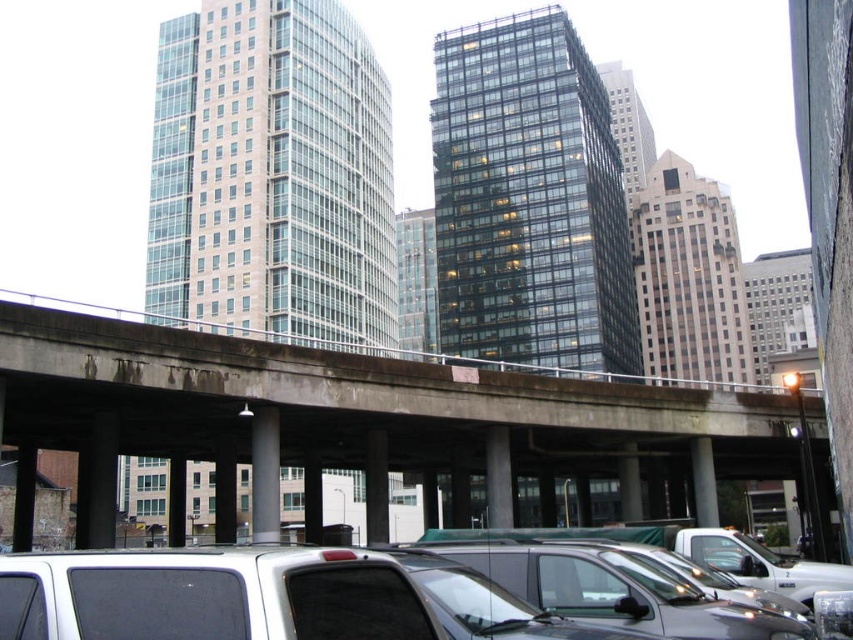
You are a delivery driver who needs to park your white matte van at lower left in a spot designated for vehicles no wider than the shiny black car at center. Can your van fit into this parking spot?

The white matte van at lower left is wider than the shiny black car at center, so it cannot fit into a parking spot designed for vehicles no wider than the shiny black car at center.

You are a delivery driver needing to park your truck between the shiny black car at center and the white van or truck in the parking lot. The minimum distance required between vehicles for your truck is 23 meters. Can you safely park there?

Answer: The distance between the shiny black car at center and the white van or truck is 22.95 meters, which is slightly less than the required 23 meters. Therefore, you cannot safely park there.

You are a delivery driver trying to park your shiny black car at center in the parking lot. The parking spot you want is marked by the concrete at center. Can you fit your car into the parking spot based on their widths?

The concrete at center, which marks the parking spot, has a width that surpasses the shiny black car at center. Therefore, the shiny black car at center can fit into the parking spot as the concrete at center is wider.